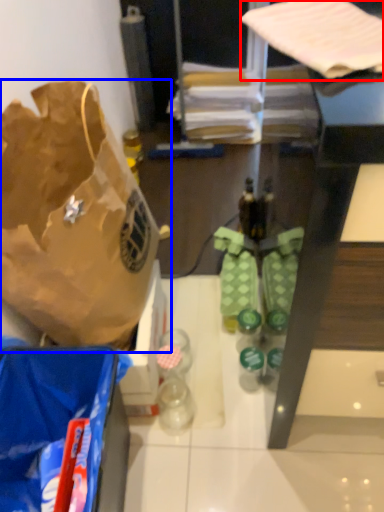
Question: Which point is further to the camera, wrapping paper (highlighted by a red box) or handbag (highlighted by a blue box)?

Choices:
 (A) wrapping paper
 (B) handbag

Answer: (B)